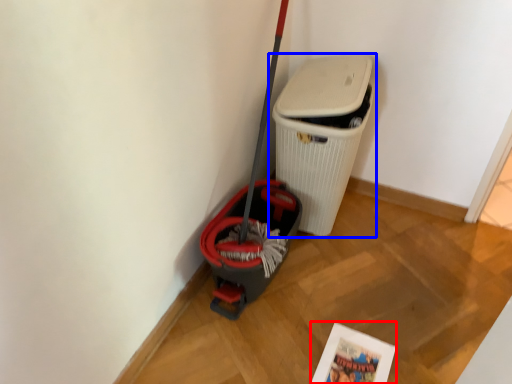
Question: Among these objects, which one is farthest to the camera, comic book (highlighted by a red box) or waste container (highlighted by a blue box)?

Choices:
 (A) comic book
 (B) waste container

Answer: (B)